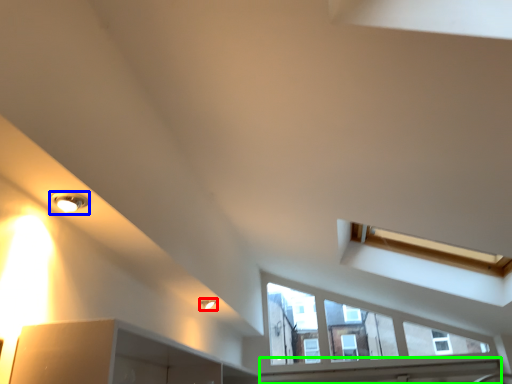
Question: Estimate the real-world distances between objects in this image. Which object is farther from light fixture (highlighted by a red box), light fixture (highlighted by a blue box) or window sill (highlighted by a green box)?

Choices:
 (A) light fixture
 (B) window sill

Answer: (B)